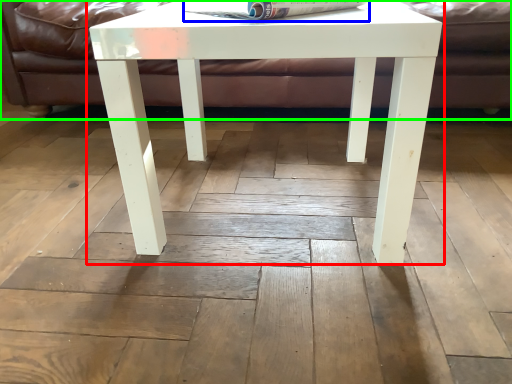
Question: Based on their relative distances, which object is nearer to table (highlighted by a red box)? Choose from magazine (highlighted by a blue box) and couch (highlighted by a green box).

Choices:
 (A) magazine
 (B) couch

Answer: (A)